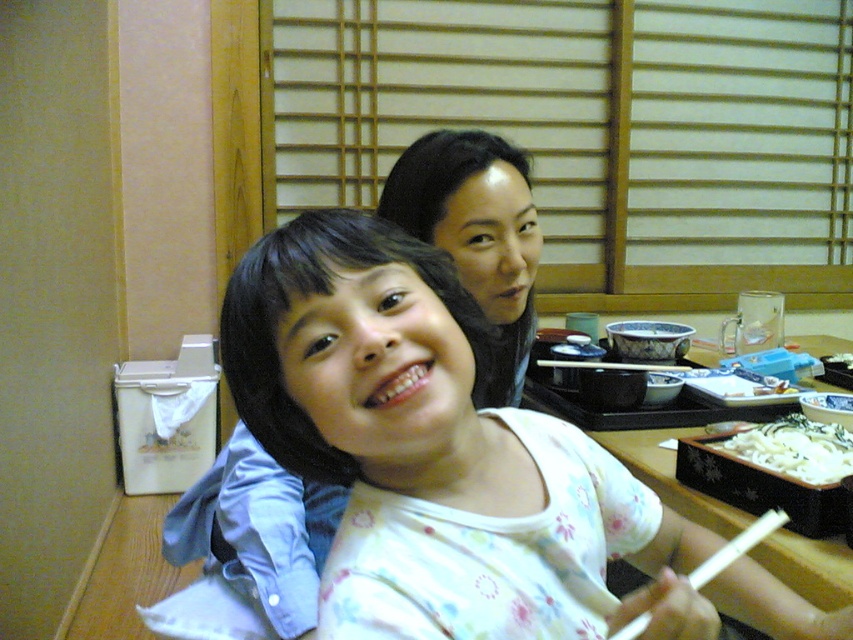
You are a chef in a traditional Japanese restaurant. You need to place a new dish on the wooden table at center and the white creamy noodles at lower right. Which object should you place the dish on to ensure it fits properly?

The wooden table at center is bigger than the white creamy noodles at lower right, so you should place the dish on the wooden table at center to ensure it fits properly.

You are a guest at this Japanese restaurant and want to place your white plastic chopstick at lower center back onto the wooden table at center after using it. Is the chopstick already on the table?

The wooden table at center is above the white plastic chopstick at lower center, which means the chopstick is not currently on the table. You need to place it back onto the table.

Based on the photo, you are a customer at this traditional Japanese restaurant and need to place your chopsticks on the wooden table at center. Based on the coordinates provided, where exactly should you place them?

The wooden table at center is located at coordinates point (669, 476), so you should place your chopsticks there.